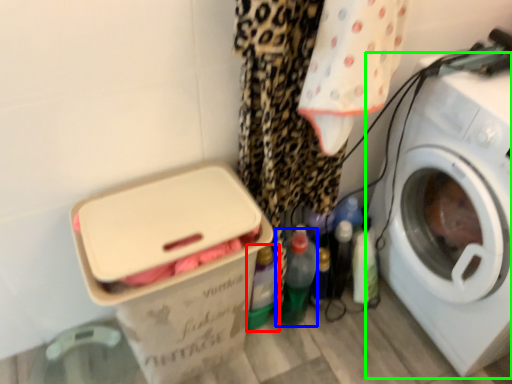
Question: Which is farther away from bottle (highlighted by a red box)? bottle (highlighted by a blue box) or washing machine (highlighted by a green box)?

Choices:
 (A) bottle
 (B) washing machine

Answer: (B)